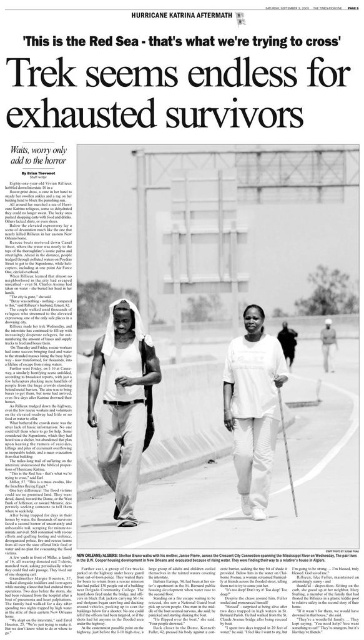
Is white plastic bag at center shorter than dark brown leather bag at center?

In fact, white plastic bag at center may be taller than dark brown leather bag at center.

Can you confirm if white plastic bag at center is taller than dark brown leather bag at center?

Yes, white plastic bag at center is taller than dark brown leather bag at center.

Between point (329, 317) and point (293, 362), which one is positioned in front?

Point (293, 362) is in front.

Where is `white plastic bag at center`? white plastic bag at center is located at coordinates (327, 344).

Based on the photo, does white cotton tank top at center have a larger size compared to white cotton shirt at center?

Yes, white cotton tank top at center is bigger than white cotton shirt at center.

Between white cotton tank top at center and white cotton shirt at center, which one has more height?

Standing taller between the two is white cotton tank top at center.

Between point (117, 360) and point (239, 355), which one is positioned behind?

Positioned behind is point (239, 355).

You are a GUI agent. You are given a task and a screenshot of the screen. Output one action in this format:
    pyautogui.click(x=<x>, y=<y>)
    Task: Click on the white cotton tank top at center
    Image resolution: width=364 pixels, height=640 pixels.
    Given the screenshot: What is the action you would take?
    pyautogui.click(x=123, y=403)

Does white cotton shirt at center appear on the right side of dark brown leather bag at center?

Incorrect, white cotton shirt at center is not on the right side of dark brown leather bag at center.

Consider the image. Does white cotton shirt at center have a greater width compared to dark brown leather bag at center?

Incorrect, white cotton shirt at center's width does not surpass dark brown leather bag at center's.

Which is in front, point (242, 445) or point (287, 326)?

Point (242, 445)

Find the location of a particular element. This screenshot has height=640, width=364. white cotton shirt at center is located at coordinates (252, 406).